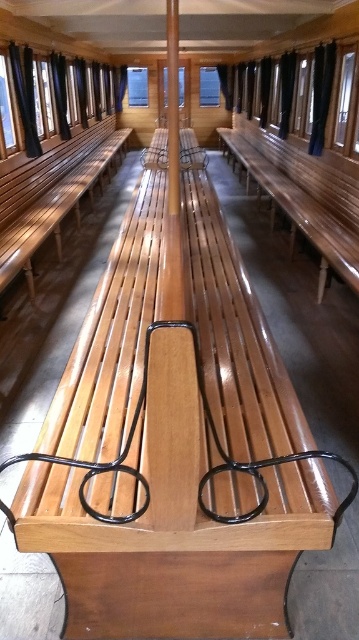
You are standing at the entrance of the vintage train car and see the point marked at coordinates (304, 195). What object does this point correspond to?

The point at coordinates (304, 195) corresponds to the glossy wood bench at center.

You are a luggage cart operator who needs to move a cart that is 3 feet wide through the aisle between the glossy wood bench at center and the shiny brown wood bench at left. Can the cart fit through the aisle between them?

The glossy wood bench at center is 9.42 feet from the shiny brown wood bench at left. Since the cart is 3 feet wide, there is sufficient space for it to pass through the aisle between them.

You are standing at the entrance of the vintage train car and want to sit on the glossy wood bench at center. Based on the coordinates provided, is the bench positioned closer to the front or the back of the train car?

The glossy wood bench at center is located at point 0.305 on the x and 0.847 on the y axis. Since the coordinates are relative to the image, the bench is closer to the back of the train car as it has a higher y value.